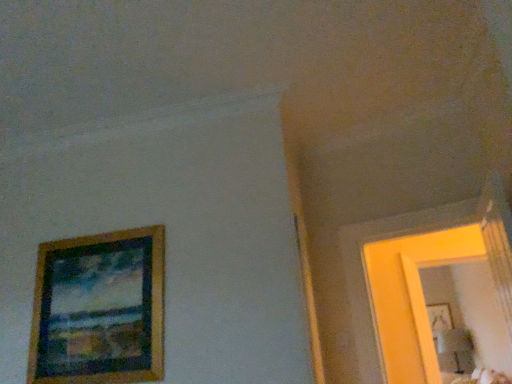
Question: From a real-world perspective, is matte yellow mirror at right positioned above or below wooden picture frame at upper right, which is the second picture frame in front-to-back order?

Choices:
 (A) above
 (B) below

Answer: (B)

Question: Looking at their shapes, would you say matte yellow mirror at right is wider or thinner than wooden picture frame at upper right, acting as the 2th picture frame starting from the top?

Choices:
 (A) thin
 (B) wide

Answer: (B)

Question: Which object is the farthest from the wooden picture frame at left, positioned as the 2th picture frame in bottom-to-top order?

Choices:
 (A) matte yellow mirror at right
 (B) wooden picture frame at upper right, which is the second picture frame in front-to-back order

Answer: (B)

Question: Which is farther from the wooden picture frame at left, the first picture frame in the front-to-back sequence?

Choices:
 (A) wooden picture frame at upper right, acting as the 2th picture frame starting from the top
 (B) matte yellow mirror at right

Answer: (A)